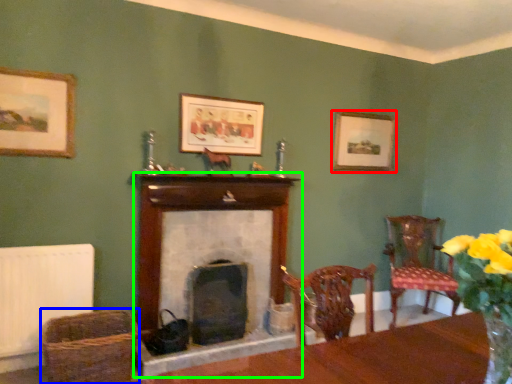
Question: Estimate the real-world distances between objects in this image. Which object is closer to picture frame (highlighted by a red box), basket (highlighted by a blue box) or fireplace (highlighted by a green box)?

Choices:
 (A) basket
 (B) fireplace

Answer: (B)